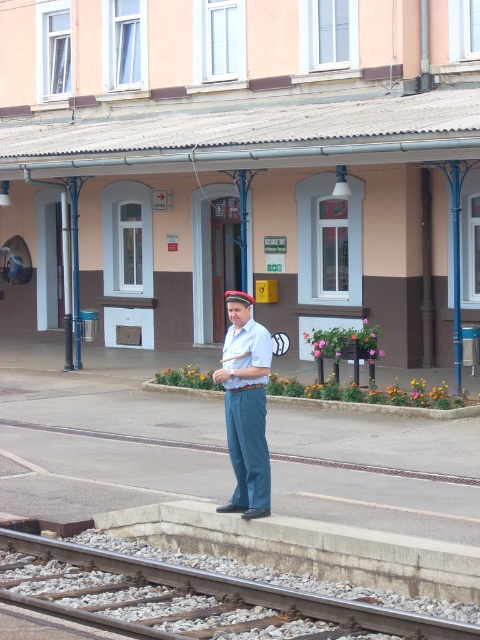
You are a passenger waiting for your train at the station. You see a smooth metal rail at lower center and blue cotton pants at center. How far apart are these two items?

The smooth metal rail at lower center and blue cotton pants at center are 7.29 feet apart.